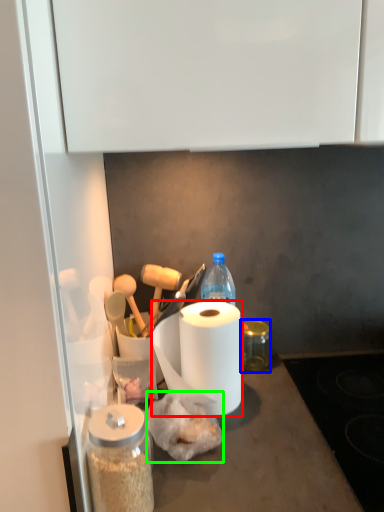
Question: Which object is the farthest from paper towel (highlighted by a red box)? Choose among these: glass jar (highlighted by a blue box) or food (highlighted by a green box).

Choices:
 (A) glass jar
 (B) food

Answer: (A)